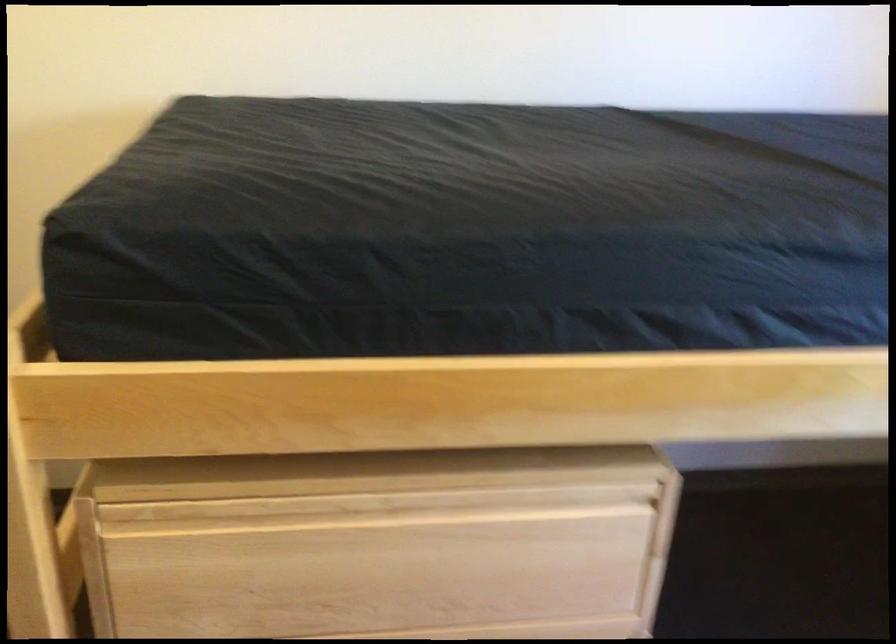
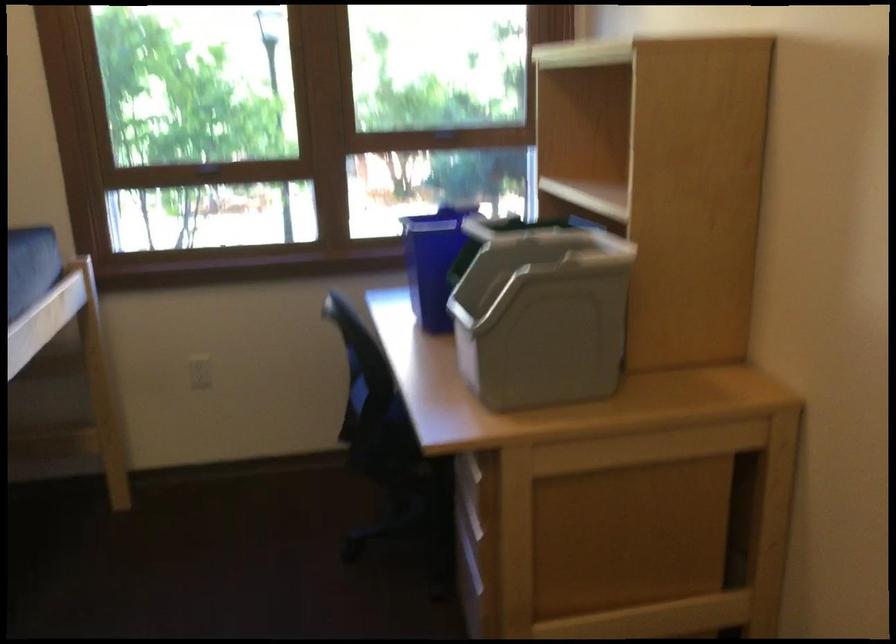
Based on the continuous images, in which direction is the camera rotating?

The camera rotated toward right-down.